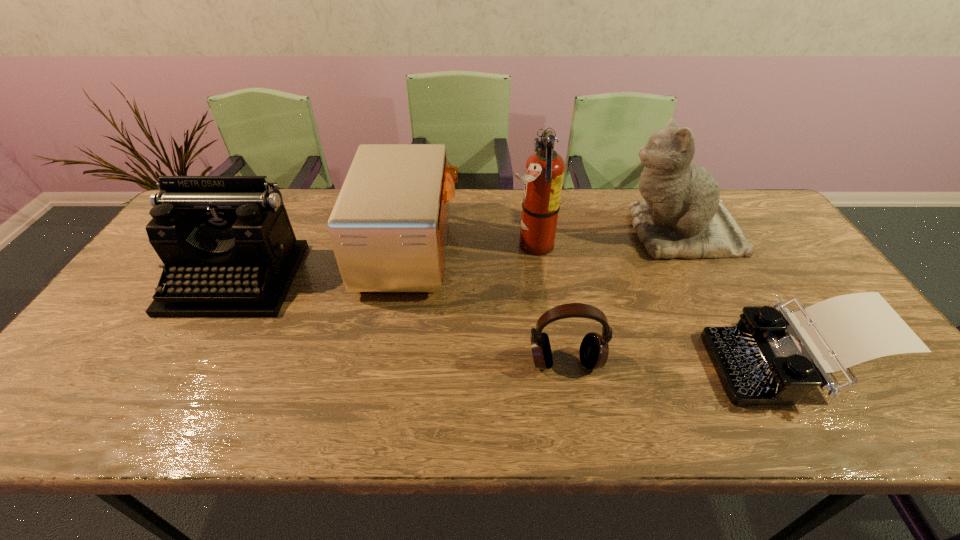
The height and width of the screenshot is (540, 960). I want to click on free location located from the nozzle of the fire extinguisher, so click(492, 245).

The image size is (960, 540). Identify the location of vacant space located 0.370m on the front-facing side of the cat. (501, 233).

This screenshot has width=960, height=540. Identify the location of free space located 0.250m on the front-facing side of the cat. (539, 233).

Find the location of `vacant space located on the front-facing side of the cat`. vacant space located on the front-facing side of the cat is located at coordinates (511, 233).

In order to click on blank space located on the typing side of the farther typewriter in this screenshot , I will do `click(191, 356)`.

Where is `vacant region located 0.270m on the door side of the fifth object from right to left`? The image size is (960, 540). vacant region located 0.270m on the door side of the fifth object from right to left is located at coordinates (548, 249).

Find the location of a particular element. This screenshot has width=960, height=540. vacant space located on the ear pads of the headset is located at coordinates (571, 397).

The image size is (960, 540). I want to click on vacant area situated 0.060m on the keys of the right typewriter, so click(x=686, y=365).

Locate an element on the screen. vacant area situated on the keys of the right typewriter is located at coordinates (690, 365).

The image size is (960, 540). What are the coordinates of `vacant space positioned 0.180m on the keys of the right typewriter` in the screenshot? It's located at (635, 365).